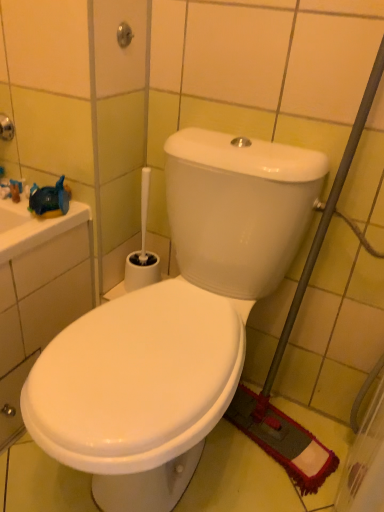
Question: In terms of width, does brushed metal showerhead at upper center look wider or thinner when compared to white glossy toilet at center?

Choices:
 (A) wide
 (B) thin

Answer: (B)

Question: From their relative heights in the image, would you say brushed metal showerhead at upper center is taller or shorter than white glossy toilet at center?

Choices:
 (A) short
 (B) tall

Answer: (A)

Question: Based on their relative distances, which object is farther from the brushed metal showerhead at upper center?

Choices:
 (A) white plastic toilet brush at lower center
 (B) white glossy toilet at center

Answer: (B)

Question: Considering the real-world distances, which object is closest to the white glossy toilet at center?

Choices:
 (A) brushed metal showerhead at upper center
 (B) white plastic toilet brush at lower center

Answer: (B)